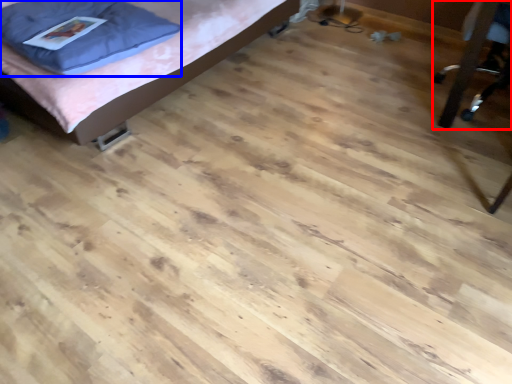
Question: Which object is further to the camera taking this photo, furniture (highlighted by a red box) or pillow (highlighted by a blue box)?

Choices:
 (A) furniture
 (B) pillow

Answer: (B)